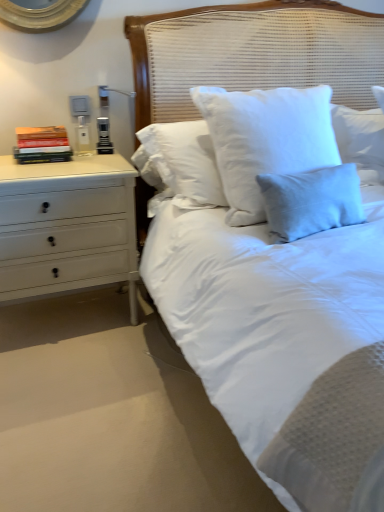
Question: Is white woven headboard at center located outside hardcover books at left?

Choices:
 (A) yes
 (B) no

Answer: (A)

Question: From a real-world perspective, is white woven headboard at center physically below hardcover books at left?

Choices:
 (A) no
 (B) yes

Answer: (A)

Question: Is white woven headboard at center further to camera compared to hardcover books at left?

Choices:
 (A) no
 (B) yes

Answer: (A)

Question: Considering the relative positions of white woven headboard at center and hardcover books at left in the image provided, is white woven headboard at center to the right of hardcover books at left from the viewer's perspective?

Choices:
 (A) yes
 (B) no

Answer: (A)

Question: From a real-world perspective, is white woven headboard at center on top of hardcover books at left?

Choices:
 (A) yes
 (B) no

Answer: (A)

Question: Is white woven headboard at center in contact with hardcover books at left?

Choices:
 (A) yes
 (B) no

Answer: (B)

Question: Considering the relative sizes of hardcover books at left and white painted wood chest of drawers at left in the image provided, is hardcover books at left bigger than white painted wood chest of drawers at left?

Choices:
 (A) no
 (B) yes

Answer: (A)

Question: Considering the relative sizes of hardcover books at left and white painted wood chest of drawers at left in the image provided, is hardcover books at left wider than white painted wood chest of drawers at left?

Choices:
 (A) yes
 (B) no

Answer: (B)

Question: Does hardcover books at left have a smaller size compared to white painted wood chest of drawers at left?

Choices:
 (A) yes
 (B) no

Answer: (A)

Question: Does hardcover books at left lie behind white painted wood chest of drawers at left?

Choices:
 (A) yes
 (B) no

Answer: (A)

Question: Is hardcover books at left at the left side of white painted wood chest of drawers at left?

Choices:
 (A) yes
 (B) no

Answer: (A)

Question: From the image's perspective, is hardcover books at left below white painted wood chest of drawers at left?

Choices:
 (A) no
 (B) yes

Answer: (A)

Question: Is the surface of white painted wood chest of drawers at left in direct contact with white woven headboard at center?

Choices:
 (A) yes
 (B) no

Answer: (B)